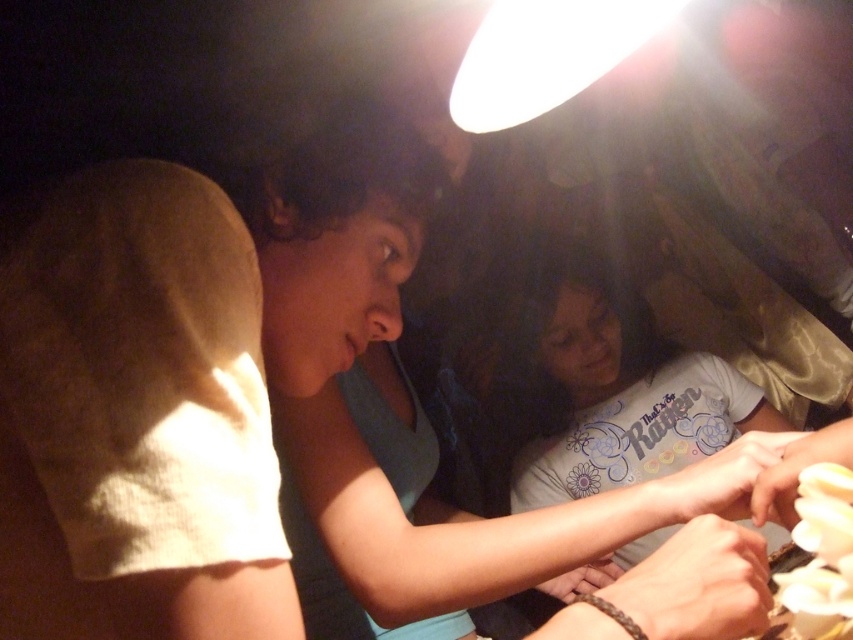
You are an observer in the scene. You notice the smooth yellow hand at lower right and the brown woven bracelet at lower center. Which object is positioned higher from the ground?

The smooth yellow hand at lower right is above the brown woven bracelet at lower center, so it is positioned higher from the ground.

You are standing in the room and want to move from the point at coordinates point (785, 499) to the point at coordinates point (614, 620). Can you walk directly between them without any obstacles?

Point (785, 499) is behind point (614, 620), so there is an obstacle blocking the path between them. You cannot walk directly between them without moving around the obstacle.

You are a chef preparing a dish and need to place the white glossy food at lower right and the smooth skin hand at lower right on a 12 cm wide plate. Can both fit side by side on the plate without overlapping?

The white glossy food at lower right and smooth skin hand at lower right are 11.93 centimeters apart, so yes, both can fit side by side on the 12 cm wide plate since the distance between them is slightly less than the plate width.